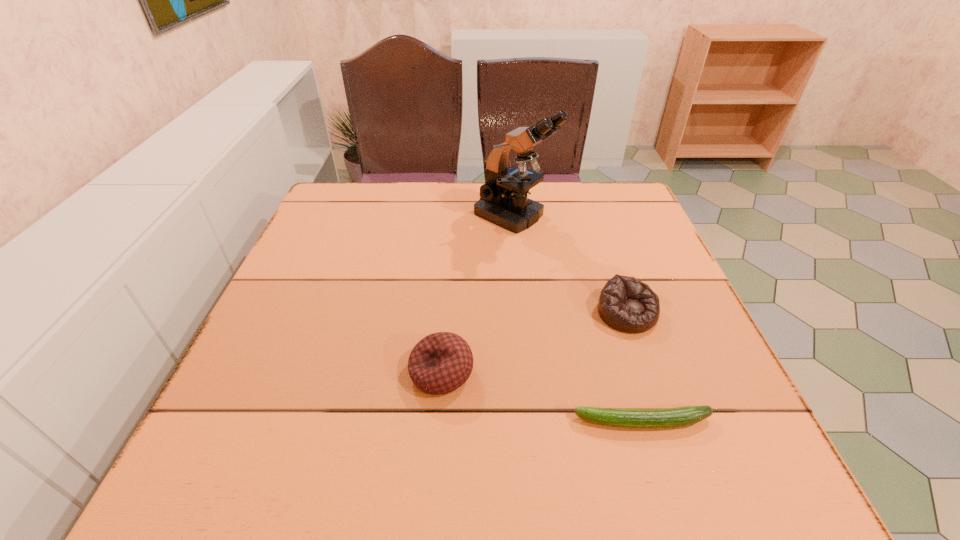
At what (x,y) coordinates should I click in order to perform the action: click on vacant point at the right edge. Please return your answer as a coordinate pair (x, y). Looking at the image, I should click on (657, 388).

What are the coordinates of `free space at the far left corner` in the screenshot? It's located at (368, 191).

The width and height of the screenshot is (960, 540). In order to click on vacant space at the near left corner of the desktop in this screenshot , I will do `click(277, 480)`.

Locate an element on the screen. vacant space at the far right corner is located at coordinates (591, 203).

Locate an element on the screen. free space between the farthest object and the third nearest object is located at coordinates (570, 264).

Identify the location of free spot between the taller beanbag and the microscope. (477, 294).

Where is `vacant space that's between the zucchini and the microscope`? vacant space that's between the zucchini and the microscope is located at coordinates (578, 319).

Where is `free space between the second nearest object and the microscope`? The image size is (960, 540). free space between the second nearest object and the microscope is located at coordinates pos(477,294).

This screenshot has height=540, width=960. Find the location of `unoccupied area between the tallest object and the second tallest object`. unoccupied area between the tallest object and the second tallest object is located at coordinates (477, 294).

Locate an element on the screen. This screenshot has width=960, height=540. free space between the taller beanbag and the tallest object is located at coordinates (477, 294).